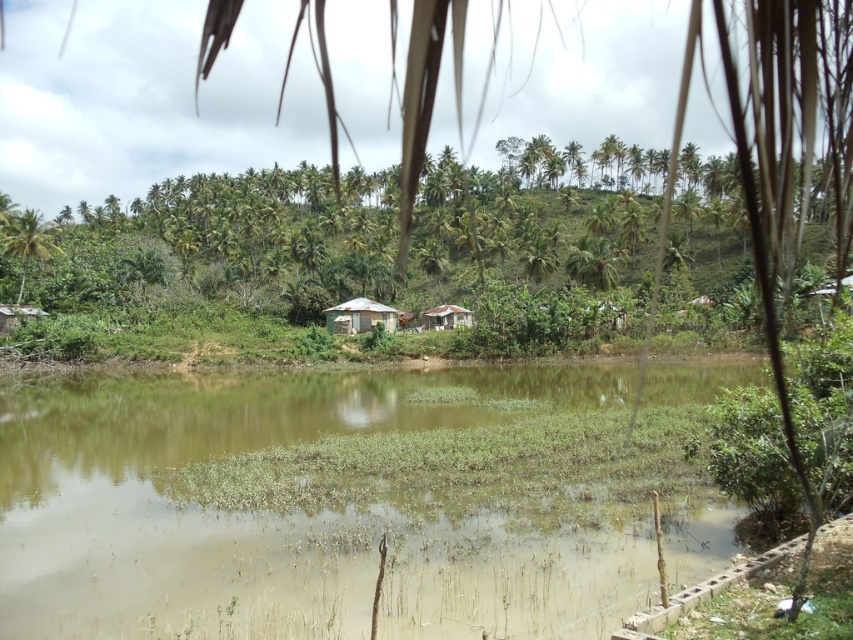
You are a delivery person trying to deliver a package to the green corrugated metal hut at center and the rusty corrugated metal hut at center. The delivery requires knowing which one is taller. Which one should you note as taller?

The green corrugated metal hut at center is taller than the rusty corrugated metal hut at center.

You are a delivery person trying to deliver a package to the green corrugated metal hut at center. However, there is a rusty corrugated metal hut at center blocking your path. Can you pass through the space between them?

The green corrugated metal hut at center has a larger size compared to rusty corrugated metal hut at center, so the space between them is narrower than the size of the larger hut. Therefore, you cannot pass through the space between them.